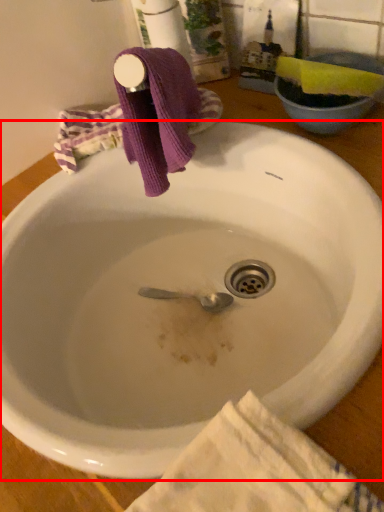
Question: Observing the image, what is the correct spatial positioning of sink (annotated by the red box) in reference to beach towel?

Choices:
 (A) right
 (B) left

Answer: (B)